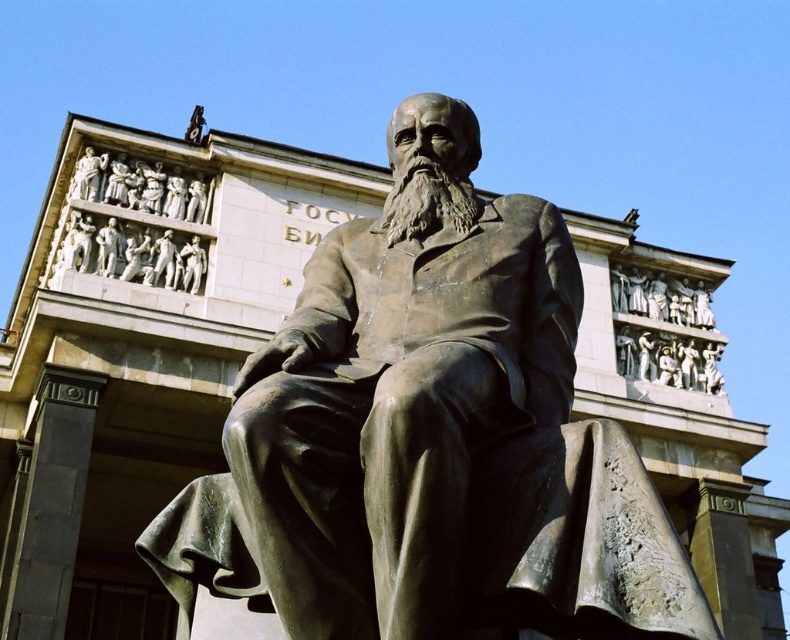
Describe the element at coordinates (431, 456) in the screenshot. I see `bronze statue at center` at that location.

Find the location of a particular element. Image resolution: width=790 pixels, height=640 pixels. bronze statue at center is located at coordinates (431, 456).